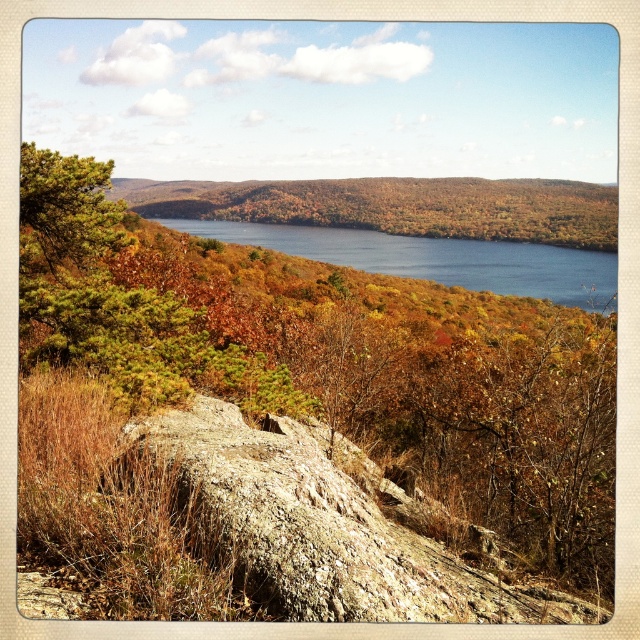
Consider the image. Does autumn foliage at center come behind blue water at center?

No, it is in front of blue water at center.

Is autumn foliage at center thinner than blue water at center?

Incorrect, autumn foliage at center's width is not less than blue water at center's.

Which is in front, point (426, 196) or point (262, 228)?

Point (262, 228) is in front.

You are a GUI agent. You are given a task and a screenshot of the screen. Output one action in this format:
    pyautogui.click(x=<x>, y=<y>)
    Task: Click on the autumn foliage at center
    The image size is (640, 640).
    Given the screenshot: What is the action you would take?
    pyautogui.click(x=397, y=205)

Which is more to the left, brown rough rock at center or autumn foliage at center?

brown rough rock at center is more to the left.

Does brown rough rock at center have a lesser width compared to autumn foliage at center?

Yes, brown rough rock at center is thinner than autumn foliage at center.

This screenshot has width=640, height=640. In order to click on brown rough rock at center in this screenshot , I will do `click(332, 525)`.

Describe the element at coordinates (321, 368) in the screenshot. I see `green leafy tree at center` at that location.

Does point (122, 564) come farther from viewer compared to point (374, 561)?

No, (122, 564) is closer to viewer.

Is point (60, 285) closer to viewer compared to point (204, 420)?

No, it is behind (204, 420).

Locate an element on the screen. Image resolution: width=640 pixels, height=640 pixels. green leafy tree at center is located at coordinates (321, 368).